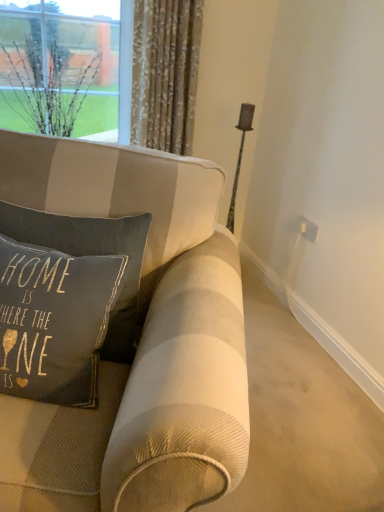
Question: Considering the positions of clear glass vase at upper left and floral fabric curtain at upper center in the image, is clear glass vase at upper left taller or shorter than floral fabric curtain at upper center?

Choices:
 (A) short
 (B) tall

Answer: (A)

Question: Considering the relative positions of clear glass vase at upper left and floral fabric curtain at upper center in the image provided, is clear glass vase at upper left to the left or to the right of floral fabric curtain at upper center?

Choices:
 (A) right
 (B) left

Answer: (B)

Question: Which object is the farthest from the dark gray fabric pillow at center?

Choices:
 (A) clear glass vase at upper left
 (B) beige striped fabric couch at center
 (C) white plastic electric outlet at upper right
 (D) floral fabric curtain at upper center

Answer: (C)

Question: Considering the real-world distances, which object is closest to the floral fabric curtain at upper center?

Choices:
 (A) beige striped fabric couch at center
 (B) clear glass vase at upper left
 (C) dark gray fabric pillow at center
 (D) white plastic electric outlet at upper right

Answer: (B)